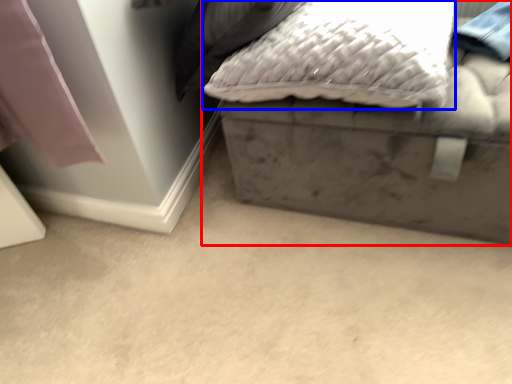
Question: Which of the following is the closest to the observer, furniture (highlighted by a red box) or pillow (highlighted by a blue box)?

Choices:
 (A) furniture
 (B) pillow

Answer: (B)